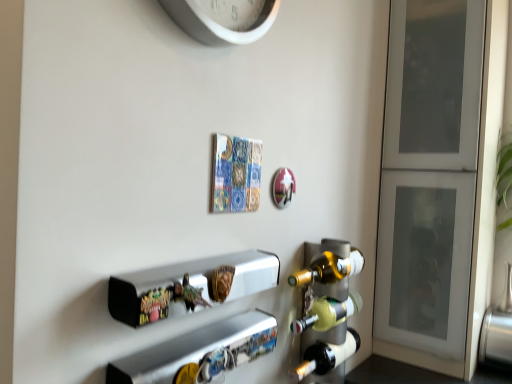
Question: Is white frosted glass cabinet at right wider or thinner than matte glass wine rack at right?

Choices:
 (A) wide
 (B) thin

Answer: (A)

Question: In terms of size, does white frosted glass cabinet at right appear bigger or smaller than matte glass wine rack at right?

Choices:
 (A) small
 (B) big

Answer: (B)

Question: Which of these objects is positioned closest to the white plastic clock at upper center?

Choices:
 (A) white frosted glass cabinet at right
 (B) metallic silver shelf at center, the first shelf viewed from the top
 (C) translucent glass beer bottle at lower right
 (D) metallic silver shelf at lower center, which ranks as the second shelf in top-to-bottom order
 (E) matte glass wine rack at right

Answer: (B)

Question: Based on their relative distances, which object is nearer to the metallic silver shelf at lower center, acting as the 1th shelf starting from the bottom?

Choices:
 (A) metallic silver shelf at center, the second shelf from the bottom
 (B) translucent glass beer bottle at lower right
 (C) white plastic clock at upper center
 (D) matte glass wine rack at right
 (E) white frosted glass cabinet at right

Answer: (A)